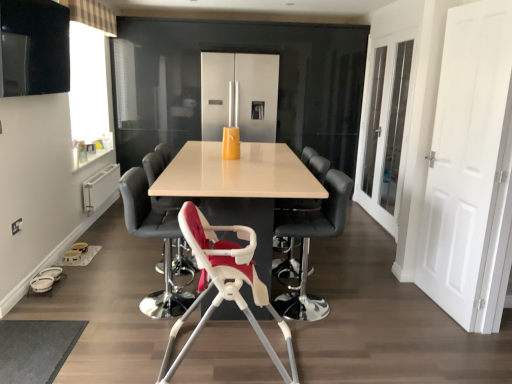
This screenshot has width=512, height=384. What are the coordinates of `vacant area located to the right-hand side of matte white table at center` in the screenshot? It's located at (382, 291).